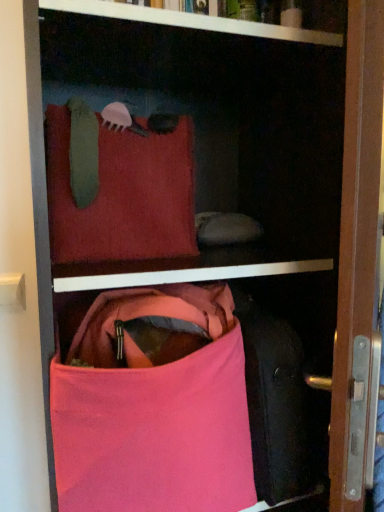
The height and width of the screenshot is (512, 384). What do you see at coordinates (123, 195) in the screenshot?
I see `velvet red pillow at upper center` at bounding box center [123, 195].

Find the location of a particular element. The image size is (384, 512). velvet red pillow at upper center is located at coordinates (123, 195).

What do you see at coordinates (153, 411) in the screenshot?
I see `pink fabric handbag at lower center` at bounding box center [153, 411].

The width and height of the screenshot is (384, 512). I want to click on pink fabric handbag at lower center, so click(x=153, y=411).

The height and width of the screenshot is (512, 384). Find the location of `velvet red pillow at upper center`. velvet red pillow at upper center is located at coordinates (123, 195).

Which object is positioned more to the right, velvet red pillow at upper center or pink fabric handbag at lower center?

pink fabric handbag at lower center.

Considering the positions of objects velvet red pillow at upper center and pink fabric handbag at lower center in the image provided, who is in front, velvet red pillow at upper center or pink fabric handbag at lower center?

pink fabric handbag at lower center.

In the scene shown: Which is farther from the camera, (139, 191) or (119, 379)?

Point (139, 191)

From the image's perspective, between velvet red pillow at upper center and pink fabric handbag at lower center, which one is located above?

velvet red pillow at upper center is shown above in the image.

From a real-world perspective, is velvet red pillow at upper center beneath pink fabric handbag at lower center?

No.

Does velvet red pillow at upper center have a lesser width compared to pink fabric handbag at lower center?

Yes.

Considering the relative sizes of velvet red pillow at upper center and pink fabric handbag at lower center in the image provided, is velvet red pillow at upper center taller than pink fabric handbag at lower center?

No.

Who is bigger, velvet red pillow at upper center or pink fabric handbag at lower center?

With larger size is pink fabric handbag at lower center.

Would you say velvet red pillow at upper center is inside or outside pink fabric handbag at lower center?

velvet red pillow at upper center is outside pink fabric handbag at lower center.

Are velvet red pillow at upper center and pink fabric handbag at lower center far apart?

No, velvet red pillow at upper center is not far from pink fabric handbag at lower center.

Could you tell me if velvet red pillow at upper center is turned towards pink fabric handbag at lower center?

No, velvet red pillow at upper center is not oriented towards pink fabric handbag at lower center.

How much distance is there between velvet red pillow at upper center and pink fabric handbag at lower center?

velvet red pillow at upper center is 22.33 centimeters from pink fabric handbag at lower center.

Find the location of a particular element. handbag located underneath the velvet red pillow at upper center (from a real-world perspective) is located at coordinates (153, 411).

Would you say pink fabric handbag at lower center is to the left or to the right of velvet red pillow at upper center in the picture?

pink fabric handbag at lower center is to the right of velvet red pillow at upper center.

Which object is more forward, pink fabric handbag at lower center or velvet red pillow at upper center?

pink fabric handbag at lower center.

Is point (68, 421) in front of point (186, 151)?

Yes, it is.

From the image's perspective, does pink fabric handbag at lower center appear lower than velvet red pillow at upper center?

Correct, pink fabric handbag at lower center appears lower than velvet red pillow at upper center in the image.

From a real-world perspective, is pink fabric handbag at lower center positioned above or below velvet red pillow at upper center?

In terms of real-world spatial position, pink fabric handbag at lower center is below velvet red pillow at upper center.

Does pink fabric handbag at lower center have a lesser width compared to velvet red pillow at upper center?

No, pink fabric handbag at lower center is not thinner than velvet red pillow at upper center.

From the picture: From their relative heights in the image, would you say pink fabric handbag at lower center is taller or shorter than velvet red pillow at upper center?

Clearly, pink fabric handbag at lower center is taller compared to velvet red pillow at upper center.

Which of these two, pink fabric handbag at lower center or velvet red pillow at upper center, is bigger?

pink fabric handbag at lower center.

Is pink fabric handbag at lower center not within velvet red pillow at upper center?

Indeed, pink fabric handbag at lower center is completely outside velvet red pillow at upper center.

Is there a large distance between pink fabric handbag at lower center and velvet red pillow at upper center?

No, pink fabric handbag at lower center is not far from velvet red pillow at upper center.

Is pink fabric handbag at lower center oriented towards velvet red pillow at upper center?

No, pink fabric handbag at lower center is not turned towards velvet red pillow at upper center.

How different are the orientations of pink fabric handbag at lower center and velvet red pillow at upper center in degrees?

pink fabric handbag at lower center and velvet red pillow at upper center are facing 0.000252 degrees away from each other.

How far apart are pink fabric handbag at lower center and velvet red pillow at upper center?

They are 8.79 inches apart.

Identify the location of pillow above the pink fabric handbag at lower center (from a real-world perspective). (123, 195).

The width and height of the screenshot is (384, 512). Identify the location of pillow on the left of pink fabric handbag at lower center. (123, 195).

The image size is (384, 512). In order to click on pillow that appears above the pink fabric handbag at lower center (from the image's perspective) in this screenshot , I will do `click(123, 195)`.